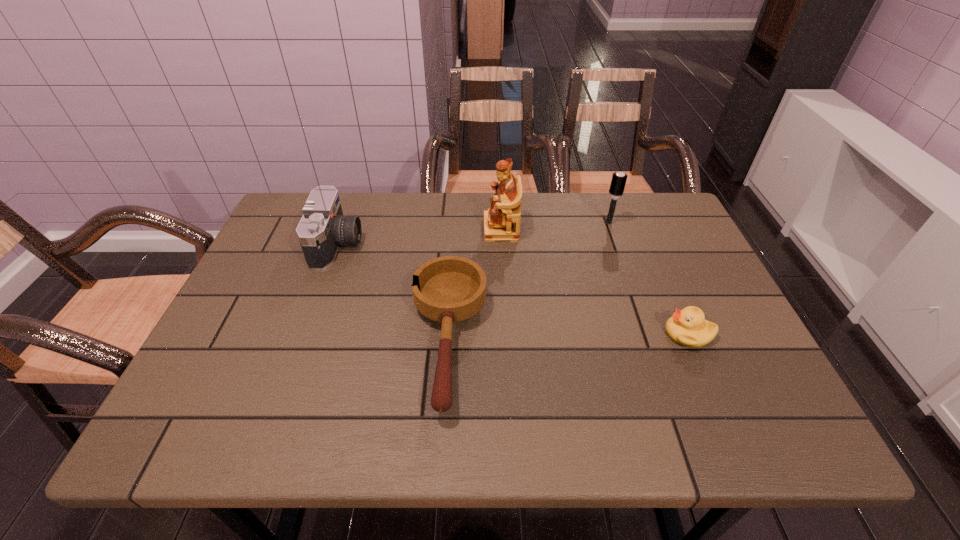
The image size is (960, 540). In order to click on the tallest object in this screenshot , I will do `click(502, 221)`.

Identify the location of the second tallest object. The height and width of the screenshot is (540, 960). (618, 181).

This screenshot has height=540, width=960. I want to click on the fourth object from left to right, so point(618,181).

The width and height of the screenshot is (960, 540). Find the location of `the third shortest object`. the third shortest object is located at coordinates (323, 228).

In order to click on the leftmost object in this screenshot , I will do pyautogui.click(x=323, y=228).

What are the coordinates of `saucepan` in the screenshot? It's located at (447, 289).

Where is `the rightmost object`? The height and width of the screenshot is (540, 960). the rightmost object is located at coordinates (688, 327).

Where is `vacant space located 0.250m on the front-facing side of the tallest object`? The image size is (960, 540). vacant space located 0.250m on the front-facing side of the tallest object is located at coordinates (397, 229).

This screenshot has width=960, height=540. Find the location of `free space located on the front-facing side of the tallest object`. free space located on the front-facing side of the tallest object is located at coordinates (347, 229).

Where is `vacant space positioned 0.080m on the front-facing side of the tallest object`? vacant space positioned 0.080m on the front-facing side of the tallest object is located at coordinates (456, 229).